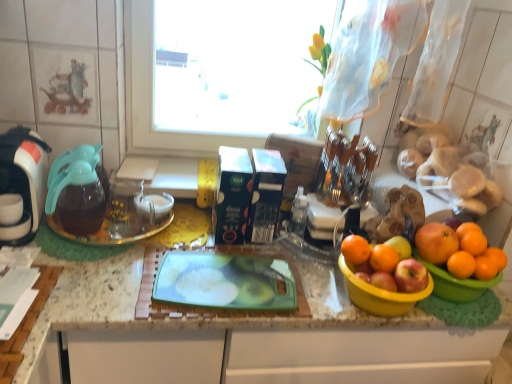
The image size is (512, 384). I want to click on green plastic cutting board at center, so click(x=243, y=337).

This screenshot has height=384, width=512. What are the coordinates of `white glossy coffee maker at left` in the screenshot? It's located at (24, 174).

I want to click on yellow plastic bowl at right, the 1th basin when ordered from left to right, so click(380, 294).

From the picture: What is the approximate width of orange matte at right, which ranks as the 5th orange in right-to-left order?

orange matte at right, which ranks as the 5th orange in right-to-left order, is 2.26 inches wide.

What is the approximate width of orange matte at right, which ranks as the 6th orange in left-to-right order?

1.71 inches.

What is the approximate height of yellow plastic bowl at right, positioned as the second basin in left-to-right order?

The height of yellow plastic bowl at right, positioned as the second basin in left-to-right order, is 4.17 inches.

Locate an element on the screen. Image resolution: width=512 pixels, height=384 pixels. green plastic cutting board at center is located at coordinates (243, 337).

Is orange matte at right, which appears as the 1th orange when viewed from the right, far from orange matte at right, arranged as the 5th orange when viewed from the left?

No, there isn't a large distance between orange matte at right, which appears as the 1th orange when viewed from the right, and orange matte at right, arranged as the 5th orange when viewed from the left.

Which is further, (482, 276) or (468, 242)?

The point (468, 242) is more distant.

Where is `orange lying on the right of orange matte at right, arranged as the 5th orange when viewed from the left`? orange lying on the right of orange matte at right, arranged as the 5th orange when viewed from the left is located at coordinates (485, 267).

Who is bigger, orange matte at right, which ranks as the 6th orange in left-to-right order, or orange matte at right, arranged as the 5th orange when viewed from the left?

orange matte at right, arranged as the 5th orange when viewed from the left, is bigger.

Which object is thinner, white glossy coffee maker at left or transparent glass plate at left?

With smaller width is transparent glass plate at left.

Is white glossy coffee maker at left spatially inside transparent glass plate at left, or outside of it?

white glossy coffee maker at left lies outside transparent glass plate at left.

Considering the relative sizes of white glossy coffee maker at left and transparent glass plate at left in the image provided, is white glossy coffee maker at left bigger than transparent glass plate at left?

Yes, white glossy coffee maker at left is bigger than transparent glass plate at left.

Does orange matte at right, which appears as the 1th orange when viewed from the right, appear on the left side of orange matte at right, arranged as the second orange when viewed from the left?

Incorrect, orange matte at right, which appears as the 1th orange when viewed from the right, is not on the left side of orange matte at right, arranged as the second orange when viewed from the left.

In the scene shown: Is orange matte at right, which ranks as the 5th orange in right-to-left order, a part of orange matte at right, which appears as the 1th orange when viewed from the right?

Actually, orange matte at right, which ranks as the 5th orange in right-to-left order, is outside orange matte at right, which appears as the 1th orange when viewed from the right.

From the orange matte at right, which ranks as the 6th orange in left-to-right order, count 1st oranges forward and point to it. Please provide its 2D coordinates.

[(384, 258)]

Does orange matte at right, which ranks as the 6th orange in left-to-right order, have a smaller size compared to orange matte at right, arranged as the second orange when viewed from the left?

Yes, orange matte at right, which ranks as the 6th orange in left-to-right order, is smaller than orange matte at right, arranged as the second orange when viewed from the left.

Based on the photo, who is shorter, transparent glass coffeepot at left or orange matte at right, placed as the 2th orange when sorted from right to left?

orange matte at right, placed as the 2th orange when sorted from right to left.

From the image's perspective, is transparent glass coffeepot at left located beneath orange matte at right, arranged as the 5th orange when viewed from the left?

No.

Is transparent glass coffeepot at left beside orange matte at right, arranged as the 5th orange when viewed from the left?

They are not placed beside each other.

Does point (483, 238) come farther from viewer compared to point (346, 255)?

Yes, it is.

Considering the sizes of objects orange matte at right, placed as the 2th orange when sorted from right to left, and orange matte at right, the 6th orange viewed from the right, in the image provided, who is thinner, orange matte at right, placed as the 2th orange when sorted from right to left, or orange matte at right, the 6th orange viewed from the right,?

Thinner between the two is orange matte at right, the 6th orange viewed from the right.

Is orange matte at right, placed as the 2th orange when sorted from right to left, shorter than orange matte at right, which is the first orange from left to right?

Indeed, orange matte at right, placed as the 2th orange when sorted from right to left, has a lesser height compared to orange matte at right, which is the first orange from left to right.

Between orange matte at right, placed as the 2th orange when sorted from right to left, and orange matte at right, which is the first orange from left to right, which one appears on the right side from the viewer's perspective?

orange matte at right, placed as the 2th orange when sorted from right to left, is more to the right.

Measure the distance from transparent glass coffeepot at left to white glossy coffee maker at left.

transparent glass coffeepot at left is 3.74 inches away from white glossy coffee maker at left.

Which of these two, transparent glass coffeepot at left or white glossy coffee maker at left, stands taller?

white glossy coffee maker at left is taller.

Which is in front, transparent glass coffeepot at left or white glossy coffee maker at left?

white glossy coffee maker at left is in front.

Find the location of `coffeepot below the white glossy coffee maker at left (from a real-world perspective)`. coffeepot below the white glossy coffee maker at left (from a real-world perspective) is located at coordinates (78, 190).

Can you confirm if orange matte at right, placed as the 2th orange when sorted from right to left, is thinner than transparent glass coffeepot at left?

Indeed, orange matte at right, placed as the 2th orange when sorted from right to left, has a lesser width compared to transparent glass coffeepot at left.

Which of these two, orange matte at right, placed as the 2th orange when sorted from right to left, or transparent glass coffeepot at left, is bigger?

Bigger between the two is transparent glass coffeepot at left.

Is orange matte at right, placed as the 2th orange when sorted from right to left, situated inside transparent glass coffeepot at left or outside?

orange matte at right, placed as the 2th orange when sorted from right to left, is spatially situated outside transparent glass coffeepot at left.

From a real-world perspective, starting from the orange matte at right, placed as the 2th orange when sorted from right to left, which orange is the 3rd one below it? Please provide its 2D coordinates.

[(485, 267)]

Find the location of a particular element. glass plate located below the white glossy coffee maker at left (from the image's perspective) is located at coordinates (108, 232).

When comparing their distances from green plastic cutting board at center, does orange matte at right, which ranks as the 5th orange in right-to-left order, or transparent glass plate at left seem closer?

transparent glass plate at left lies closer to green plastic cutting board at center than the other object.

Based on their spatial positions, is yellow plastic bowl at right, the 1th basin when ordered from left to right, or orange matte at right, arranged as the 5th orange when viewed from the left, further from orange matte at right, which is the 3th orange from right to left?

yellow plastic bowl at right, the 1th basin when ordered from left to right, is positioned further to the anchor orange matte at right, which is the 3th orange from right to left.

From the image, which object appears to be farther from white glossy coffee maker at left, orange matte at right, which appears as the 1th orange when viewed from the right, or transparent glass coffeepot at left?

orange matte at right, which appears as the 1th orange when viewed from the right, is further to white glossy coffee maker at left.

When comparing their distances from transparent glass plate at left, does orange matte at right, which ranks as the 4th orange in right-to-left order, or yellow plastic bowl at right, positioned as the second basin in left-to-right order, seem closer?

orange matte at right, which ranks as the 4th orange in right-to-left order, lies closer to transparent glass plate at left than the other object.

Estimate the real-world distances between objects in this image. Which object is closer to transparent glass plate at left, green plastic cutting board at center or orange matte at right, placed as the fourth orange when sorted from left to right?

Among the two, green plastic cutting board at center is located nearer to transparent glass plate at left.

Considering their positions, is yellow plastic bowl at right, which ranks as the 1th basin in right-to-left order, positioned further to orange matte at right, which ranks as the 6th orange in left-to-right order, than red matte apple at right?

The object further to orange matte at right, which ranks as the 6th orange in left-to-right order, is red matte apple at right.

When comparing their distances from orange matte at right, arranged as the 5th orange when viewed from the left, does orange matte at right, arranged as the second orange when viewed from the left, or orange matte at right, which ranks as the 6th orange in left-to-right order, seem closer?

orange matte at right, which ranks as the 6th orange in left-to-right order, lies closer to orange matte at right, arranged as the 5th orange when viewed from the left, than the other object.

Which object lies nearer to the anchor point orange matte at right, arranged as the 5th orange when viewed from the left, transparent glass coffeepot at left or red matte apple at right?

red matte apple at right.

What are the coordinates of `glass plate between white glossy coffee maker at left and yellow plastic bowl at right, which ranks as the 1th basin in right-to-left order, from left to right` in the screenshot? It's located at (108, 232).

I want to click on apple situated between transparent glass coffeepot at left and orange matte at right, placed as the 2th orange when sorted from right to left, from left to right, so [x=410, y=276].

Locate an element on the screen. The height and width of the screenshot is (384, 512). glass plate situated between white glossy coffee maker at left and orange matte at right, which appears as the 1th orange when viewed from the right, from left to right is located at coordinates (108, 232).

Identify the location of countertop between transparent glass coffeepot at left and orange matte at right, which is the 3th orange from right to left, in the horizontal direction. This screenshot has height=384, width=512. (243, 337).